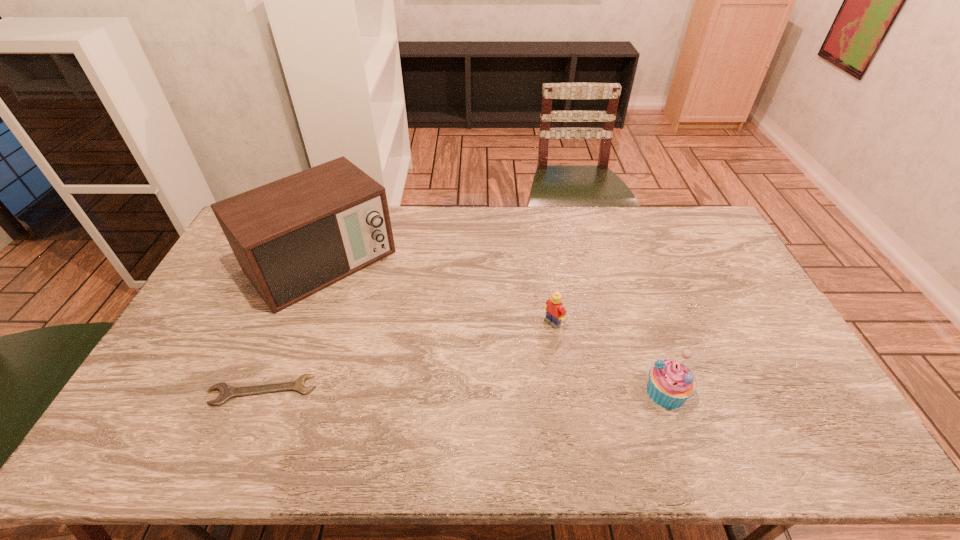
The height and width of the screenshot is (540, 960). What are the coordinates of `free spot between the third object from left to right and the radio receiver` in the screenshot? It's located at [437, 292].

Identify the location of empty location between the second object from right to left and the muffin. Image resolution: width=960 pixels, height=540 pixels. (610, 357).

Where is `free space between the wrench and the third object from left to right`? free space between the wrench and the third object from left to right is located at coordinates (407, 356).

You are a GUI agent. You are given a task and a screenshot of the screen. Output one action in this format:
    pyautogui.click(x=<x>, y=<y>)
    Task: Click on the third closest object to the third object from left to right
    
    Given the screenshot: What is the action you would take?
    pyautogui.click(x=227, y=391)

Where is `object that is the second closest to the muffin`? The width and height of the screenshot is (960, 540). object that is the second closest to the muffin is located at coordinates click(x=293, y=237).

At what (x,y) coordinates should I click in order to perform the action: click on blank space that satisfies the following two spatial constraints: 1. on the back side of the third object from left to right; 2. on the right side of the shortest object. Please return your answer as a coordinate pair (x, y). The width and height of the screenshot is (960, 540). Looking at the image, I should click on (290, 322).

This screenshot has height=540, width=960. I want to click on vacant space that satisfies the following two spatial constraints: 1. on the back side of the radio receiver; 2. on the left side of the wrench, so click(x=315, y=261).

Where is `free spot that satisfies the following two spatial constraints: 1. on the front side of the wrench; 2. on the left side of the rightmost object`? The image size is (960, 540). free spot that satisfies the following two spatial constraints: 1. on the front side of the wrench; 2. on the left side of the rightmost object is located at coordinates (262, 392).